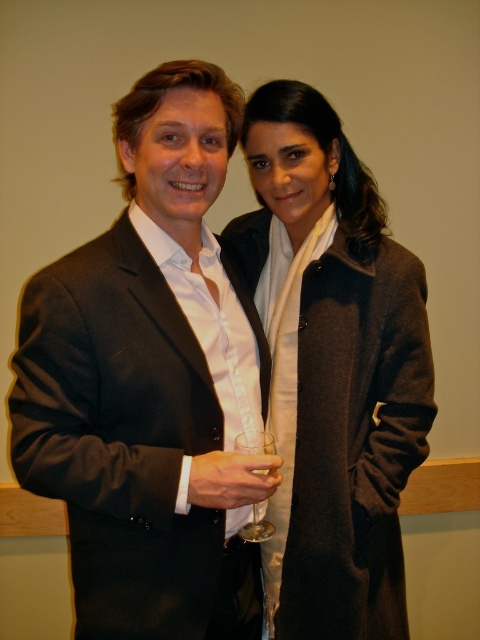
You are a photographer standing 10 feet away from the two people in the image. You want to capture a photo that includes both the black matte suit at left and the woman in the dark coat on the right. Can you fit both into your camera frame without moving closer or farther away?

The two individuals are 37.55 inches apart. Since the photographer is 10 feet away, the distance between them is within a typical camera frame at that distance, so yes, both the black matte suit at left and the woman in the dark coat on the right can be captured in the same photo without needing to adjust the position.

You are a fashion designer observing two outfits in the image. The black matte suit at left and the matte gray coat at center. Which outfit has a shorter length?

The black matte suit at left has a lesser height compared to the matte gray coat at center, so the black matte suit at left is shorter in length.

You are a photographer setting up for a group photo. You need to position the matte gray coat at center and the clear glass wine glass at center in a way that the coat is to the right of the glass. Based on the current scene, is their current arrangement correct?

Yes, the matte gray coat at center is already positioned on the right side of the clear glass wine glass at center, so their current arrangement meets the requirement.